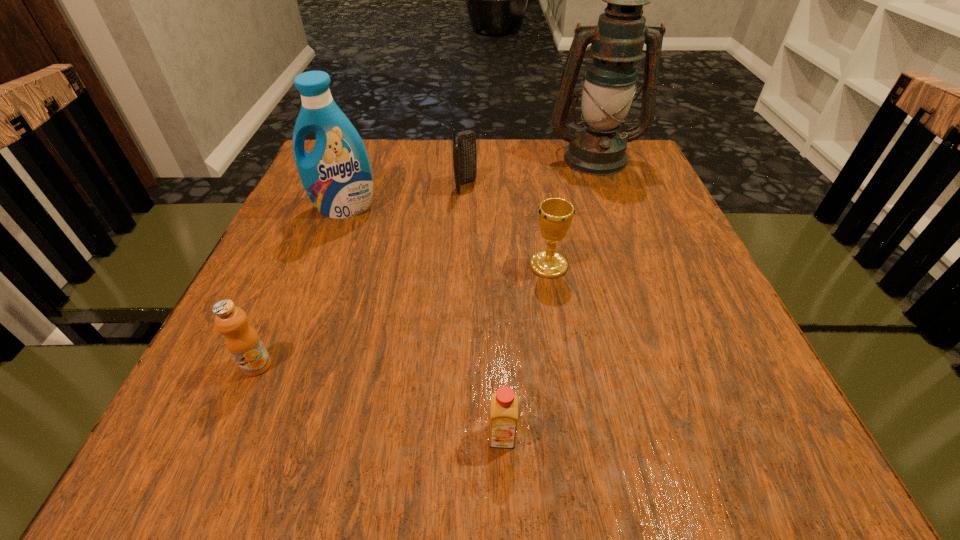
Locate an element on the screen. The image size is (960, 540). vacant region between the chalice and the fifth shortest object is located at coordinates (446, 237).

The image size is (960, 540). In order to click on vacant space that is in between the nearer orange juice and the detergent in this screenshot , I will do `click(423, 322)`.

What are the coordinates of `free space that is in between the chalice and the taller orange juice` in the screenshot? It's located at (403, 315).

The image size is (960, 540). I want to click on free spot between the oil lamp and the nearer orange juice, so pos(548,296).

Image resolution: width=960 pixels, height=540 pixels. I want to click on vacant space that is in between the farther orange juice and the fifth object from left to right, so click(403, 315).

At what (x,y) coordinates should I click in order to perform the action: click on empty location between the oil lamp and the fourth object from right to left. Please return your answer as a coordinate pair (x, y). This screenshot has height=540, width=960. Looking at the image, I should click on (530, 172).

The width and height of the screenshot is (960, 540). What are the coordinates of `object that stands as the closest to the right orange juice` in the screenshot? It's located at (555, 214).

Select which object is the fifth closest to the tallest object. Please provide its 2D coordinates. Your answer should be formatted as a tuple, i.e. [(x, y)], where the tuple contains the x and y coordinates of a point satisfying the conditions above.

[(242, 340)]

Image resolution: width=960 pixels, height=540 pixels. Identify the location of free location that satisfies the following two spatial constraints: 1. on the keyboard of the third nearest object; 2. on the right side of the third object from left to right. (463, 266).

Where is `free spot that satisfies the following two spatial constraints: 1. on the keyboard of the third tallest object; 2. on the front label of the taller orange juice`? free spot that satisfies the following two spatial constraints: 1. on the keyboard of the third tallest object; 2. on the front label of the taller orange juice is located at coordinates (458, 365).